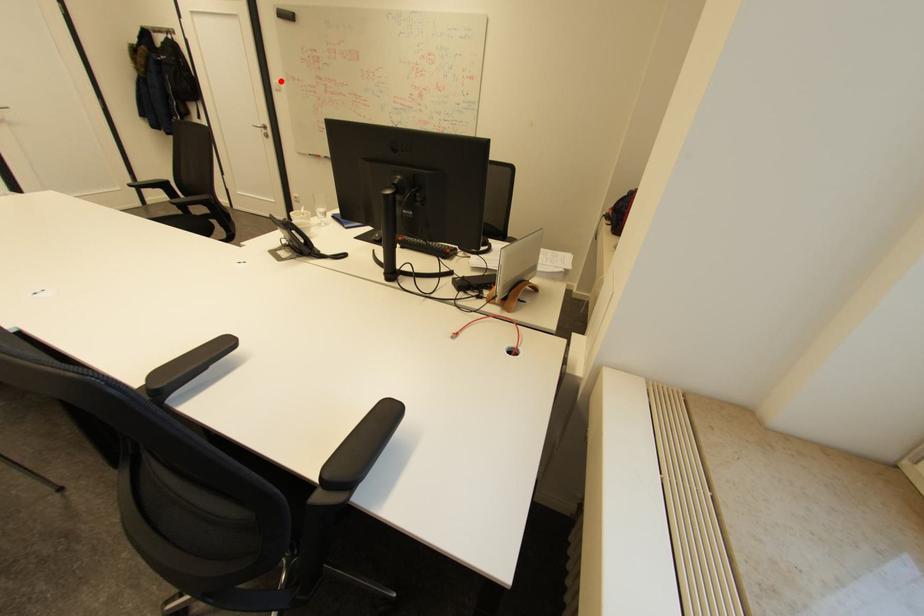
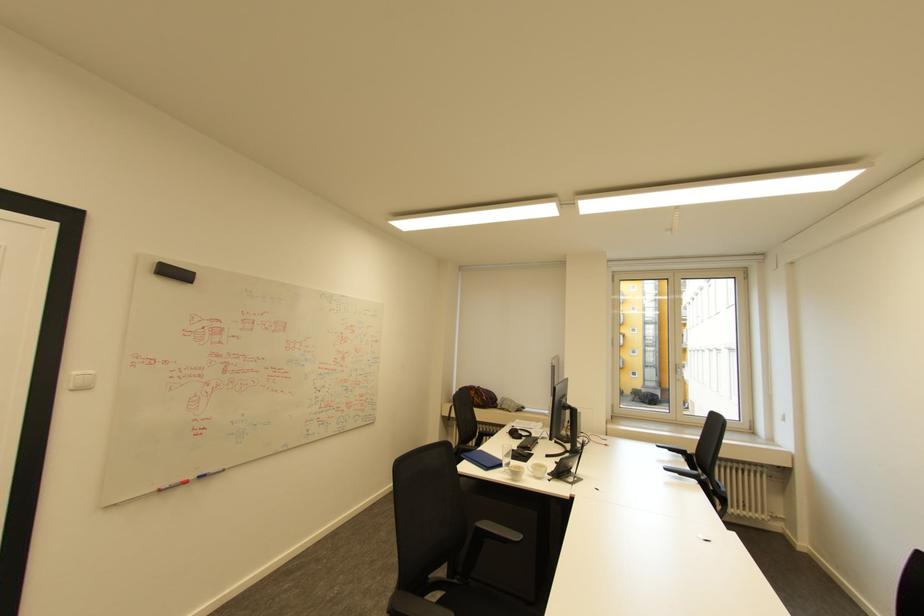
Where in the second image is the point corresponding to the highlighted location from the first image?

(79, 371)